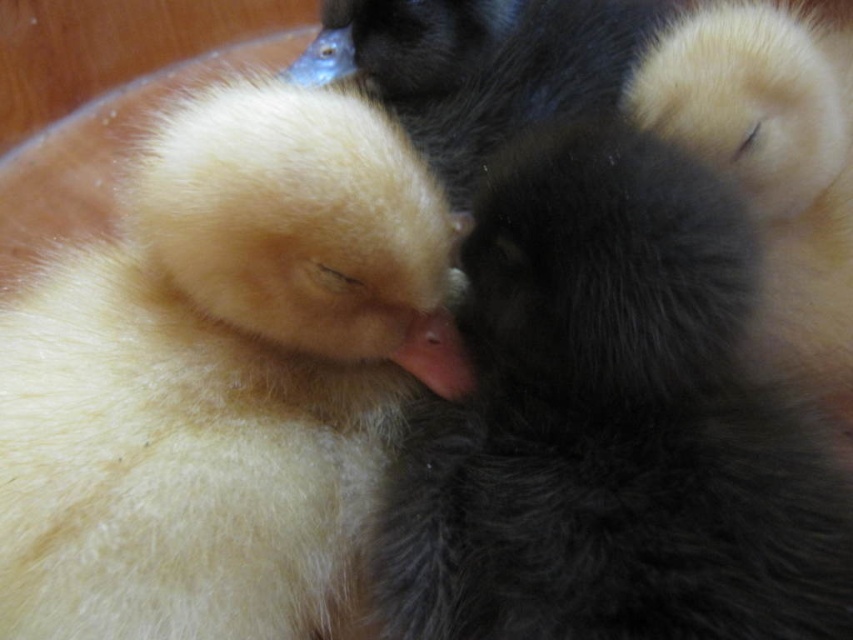
Looking at this image, you have a small toy that is 5 cm wide. You want to place it between the soft yellow duckling at left and the black fuzzy duck at center. Can the toy fit in the space between them?

The soft yellow duckling at left is narrower than the black fuzzy duck at center, so the space between them may be sufficient to fit the 5 cm wide toy. However, the exact placement depends on their positions. Since the yellow duckling is smaller in width, there might be enough space between them for the toy.

You are a parent bird watching over your two chicks. You need to ensure they are close enough to keep warm. The minimum distance required for them to stay warm is 20 inches. Are the soft yellow duckling at left and the other chick at right close enough?

The soft yellow duckling at left and the other chick at right are 30.74 inches apart, which is greater than the minimum required distance of 20 inches. Therefore, they are not close enough to keep warm.

You are a photographer trying to capture a close shot of both the black fluffy cat at center and the black fuzzy duck at center. Since your camera can only focus on one subject at a time, which one should you adjust your focus to first if you want to take a photo of the one closer to the left?

The black fluffy cat at center is positioned on the right side of the black fuzzy duck at center, so the black fuzzy duck at center is closer to the left. Therefore, you should adjust your focus to the black fuzzy duck at center first.